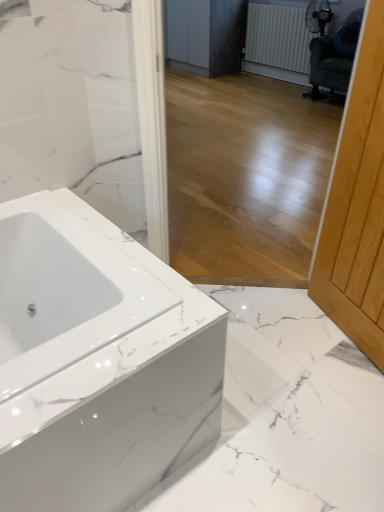
Question: Considering the relative sizes of light wood screen door at right and matte gray cabinetry at center in the image provided, is light wood screen door at right thinner than matte gray cabinetry at center?

Choices:
 (A) yes
 (B) no

Answer: (A)

Question: Would you say matte gray cabinetry at center is part of light wood screen door at right's contents?

Choices:
 (A) yes
 (B) no

Answer: (B)

Question: Is light wood screen door at right closer to camera compared to matte gray cabinetry at center?

Choices:
 (A) yes
 (B) no

Answer: (A)

Question: Does light wood screen door at right have a larger size compared to matte gray cabinetry at center?

Choices:
 (A) no
 (B) yes

Answer: (A)

Question: Is light wood screen door at right at the right side of matte gray cabinetry at center?

Choices:
 (A) yes
 (B) no

Answer: (A)

Question: From the image's perspective, is light wood screen door at right above matte gray cabinetry at center?

Choices:
 (A) no
 (B) yes

Answer: (A)

Question: Considering the relative sizes of dark green fabric swivel chair at upper right and white textured radiator at upper right in the image provided, is dark green fabric swivel chair at upper right wider than white textured radiator at upper right?

Choices:
 (A) yes
 (B) no

Answer: (A)

Question: From the image's perspective, is dark green fabric swivel chair at upper right located above white textured radiator at upper right?

Choices:
 (A) no
 (B) yes

Answer: (A)

Question: Can you confirm if dark green fabric swivel chair at upper right is shorter than white textured radiator at upper right?

Choices:
 (A) no
 (B) yes

Answer: (A)

Question: From a real-world perspective, does dark green fabric swivel chair at upper right sit lower than white textured radiator at upper right?

Choices:
 (A) yes
 (B) no

Answer: (A)

Question: Is dark green fabric swivel chair at upper right positioned with its back to white textured radiator at upper right?

Choices:
 (A) yes
 (B) no

Answer: (B)

Question: Considering the relative sizes of dark green fabric swivel chair at upper right and white textured radiator at upper right in the image provided, is dark green fabric swivel chair at upper right thinner than white textured radiator at upper right?

Choices:
 (A) yes
 (B) no

Answer: (B)

Question: Can you confirm if white textured radiator at upper right is thinner than light wood screen door at right?

Choices:
 (A) no
 (B) yes

Answer: (B)